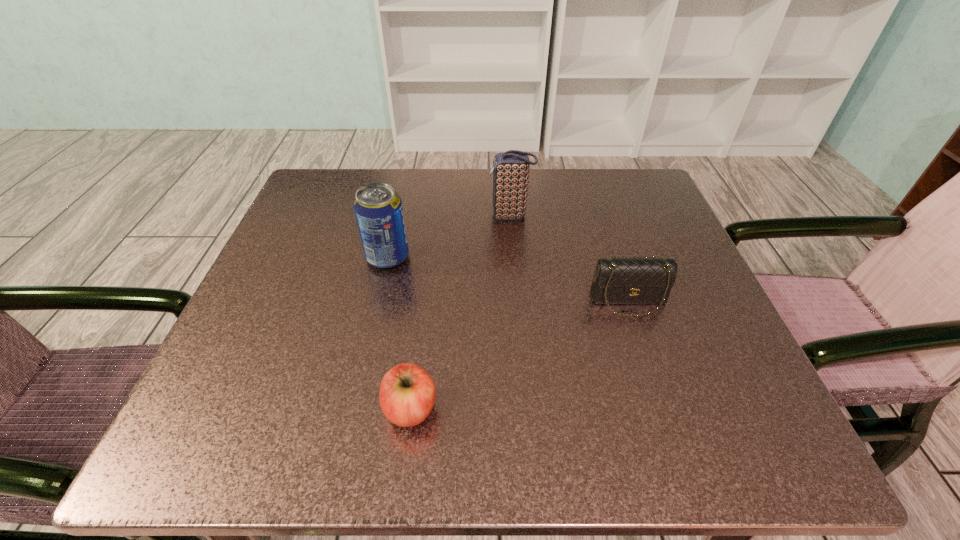
Where is `vacant position located 0.360m with the zip open on the left clutch bag`? vacant position located 0.360m with the zip open on the left clutch bag is located at coordinates pos(324,216).

Locate an element on the screen. Image resolution: width=960 pixels, height=540 pixels. vacant space located on the back of the second farthest object is located at coordinates (396, 217).

At what (x,y) coordinates should I click in order to perform the action: click on vacant position located 0.240m on the front flap of the rightmost object. Please return your answer as a coordinate pair (x, y). This screenshot has height=540, width=960. Looking at the image, I should click on (680, 455).

Locate an element on the screen. vacant space located on the back of the nearest object is located at coordinates (424, 300).

Locate an element on the screen. The height and width of the screenshot is (540, 960). object situated at the far edge is located at coordinates point(510,169).

Locate an element on the screen. object at the near edge is located at coordinates (407, 393).

The height and width of the screenshot is (540, 960). Identify the location of object present at the right edge. (621, 280).

I want to click on free space at the far edge of the desktop, so click(565, 172).

You are a GUI agent. You are given a task and a screenshot of the screen. Output one action in this format:
    pyautogui.click(x=<x>, y=<y>)
    Task: Click on the vacant space at the near edge
    The height and width of the screenshot is (540, 960).
    Given the screenshot: What is the action you would take?
    pyautogui.click(x=312, y=428)

Identify the location of blank area at the left edge. Image resolution: width=960 pixels, height=540 pixels. (292, 276).